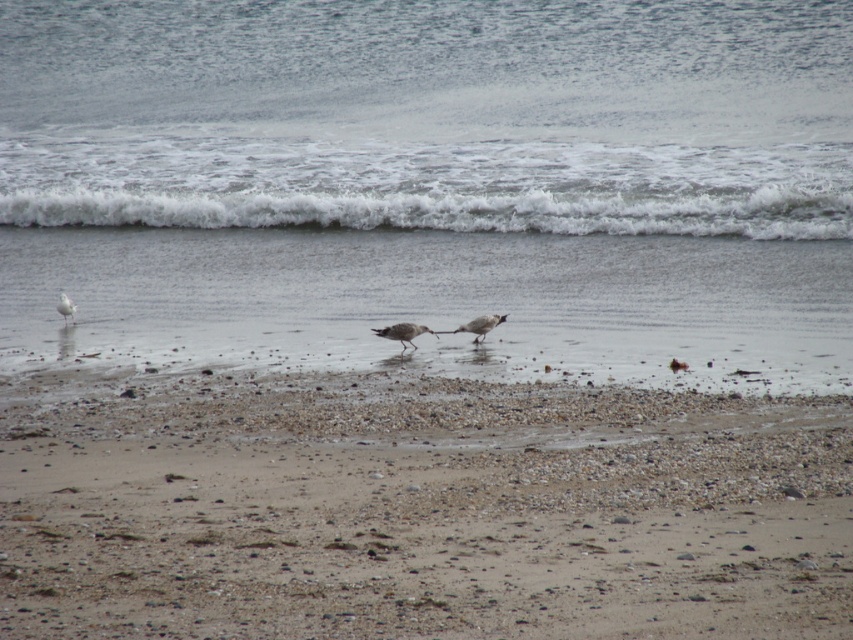
Between point (387, 332) and point (476, 330), which one is positioned behind?

The point (476, 330) is behind.

Between point (410, 337) and point (495, 323), which one is positioned in front?

Point (410, 337) is in front.

Between point (399, 323) and point (477, 317), which one is positioned in front?

Point (399, 323)

Locate an element on the screen. white feathered bird at center is located at coordinates (402, 332).

Can you confirm if white frothy water at center is positioned to the right of brown gravelly sand at lower center?

Correct, you'll find white frothy water at center to the right of brown gravelly sand at lower center.

Who is more distant from viewer, (584, 157) or (689, 547)?

Point (584, 157)

Identify the location of white frothy water at center. Image resolution: width=853 pixels, height=640 pixels. (431, 186).

The image size is (853, 640). I want to click on white frothy water at center, so click(431, 186).

Which is more to the left, white frothy water at center or white feathered bird at center?

From the viewer's perspective, white feathered bird at center appears more on the left side.

Who is positioned more to the right, white frothy water at center or white feathered bird at center?

white frothy water at center

Identify the location of white frothy water at center. Image resolution: width=853 pixels, height=640 pixels. (431, 186).

Where is `white frothy water at center`? The image size is (853, 640). white frothy water at center is located at coordinates click(x=431, y=186).